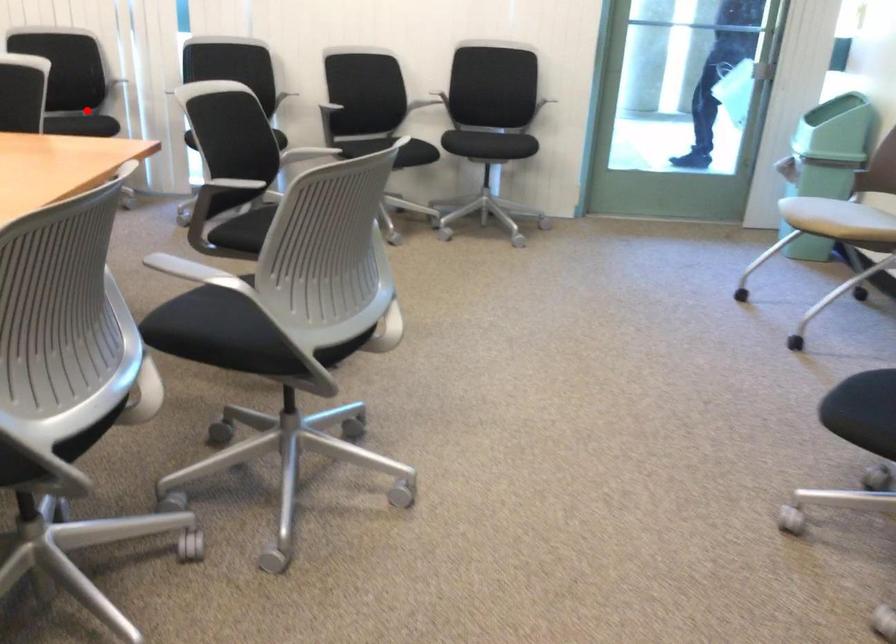
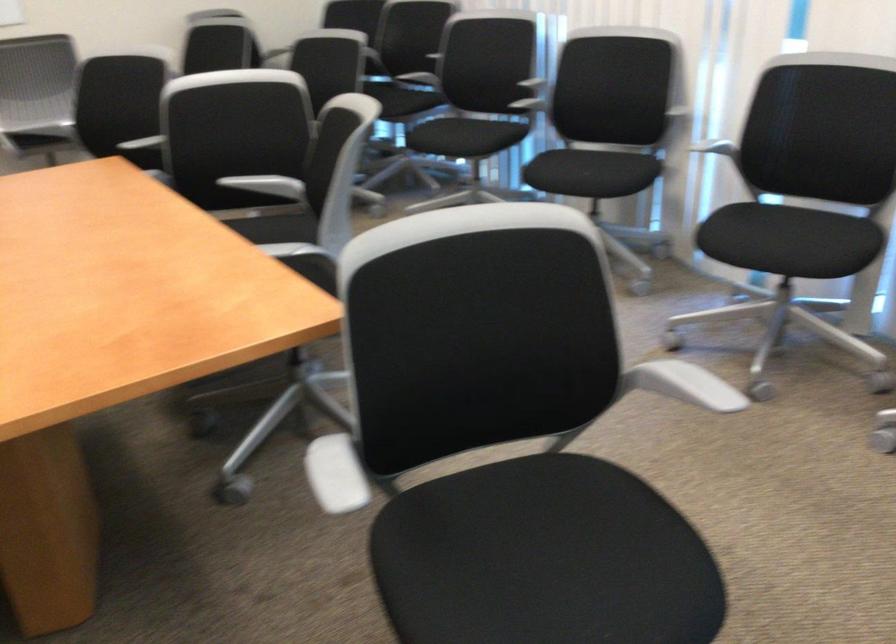
Find the pixel in the second image that matches the highlighted location in the first image.

(587, 174)